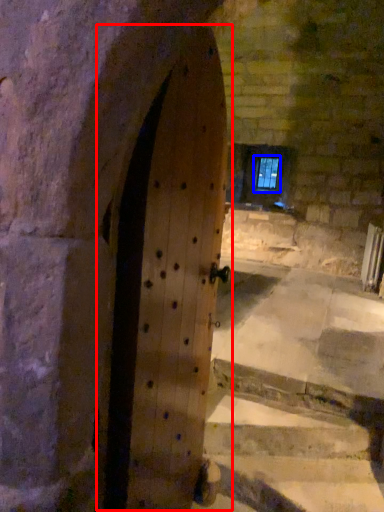
Question: Which of the following is the farthest to the observer, door (highlighted by a red box) or window (highlighted by a blue box)?

Choices:
 (A) door
 (B) window

Answer: (B)